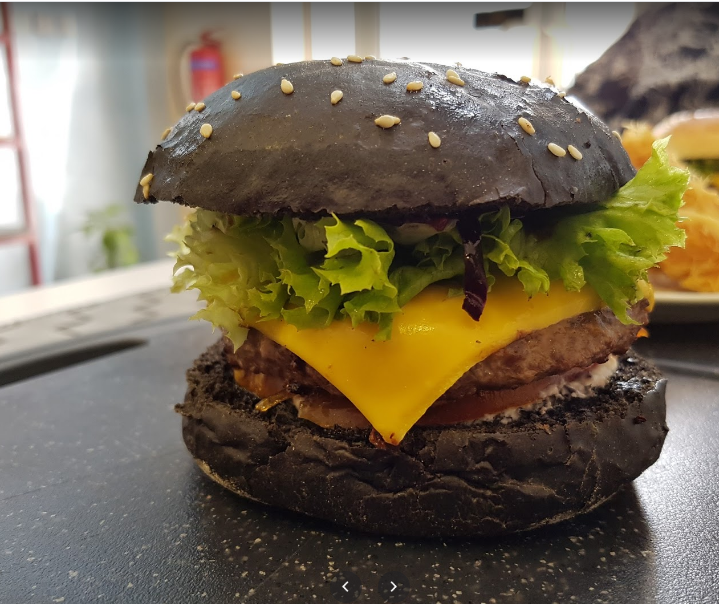
Locate an element on the screen. ladder in background is located at coordinates (9, 69).